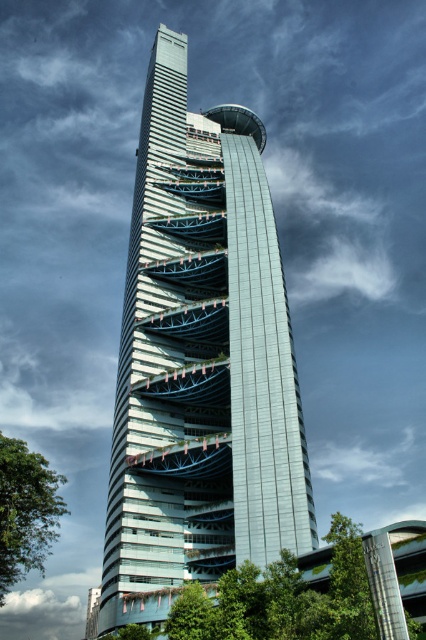
Can you confirm if glassy teal skyscraper at center is smaller than green leafy tree at lower left?

Yes.

Does point (121, 460) lie behind point (34, 493)?

Yes, point (121, 460) is farther from viewer.

The height and width of the screenshot is (640, 426). Find the location of `glassy teal skyscraper at center`. glassy teal skyscraper at center is located at coordinates (201, 362).